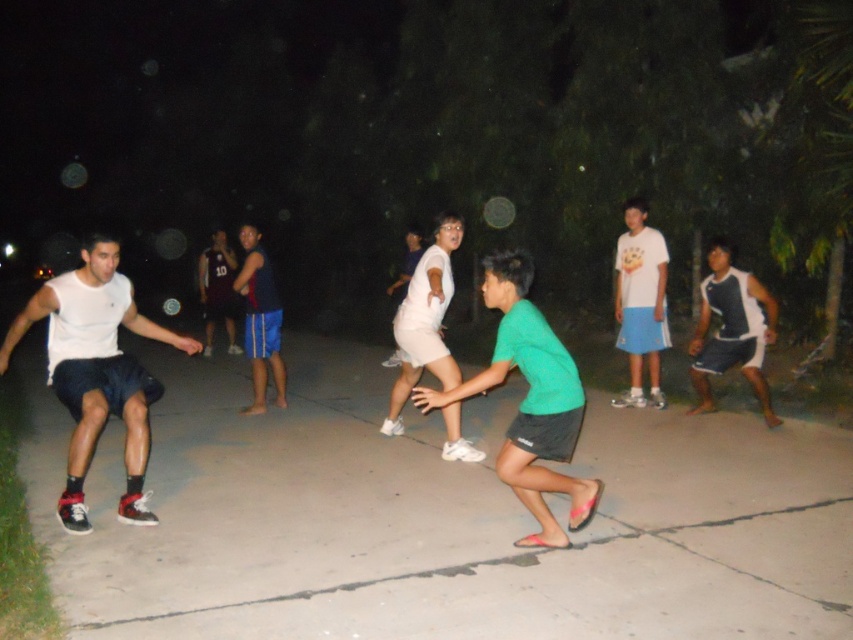
You are a photographer standing at the edge of the basketball court. You want to capture a photo that includes both the gray concrete pavement at center and the dark purple jersey at center. Given that your camera has a maximum focus range of 20 feet, will you be able to get both objects in focus at the same time?

The gray concrete pavement at center and dark purple jersey at center are 20.92 feet apart. Since the distance between them exceeds the camera maximum focus range of 20 feet, you won not be able to get both objects in focus at the same time.

You are standing in the basketball court and want to throw a ball to a friend. You have two points to choose from, point (48, 545) and point (773, 316). Which point is closer to you?

Point (48, 545) is closer to the viewer than point (773, 316), so you should throw the ball to point (48, 545).

You are a photographer trying to capture a photo of the white mesh tank top at right. Since the gray concrete pavement at center is below it, where should you aim your camera to ensure the tank top is in focus?

Since the gray concrete pavement at center is positioned under the white mesh tank top at right, you should aim your camera upwards to capture the tank top in focus.